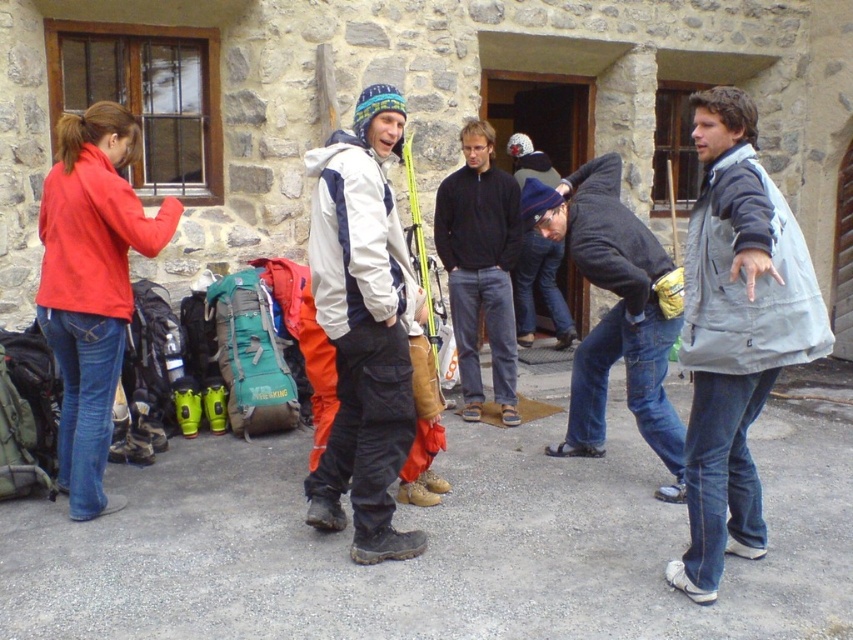
Does dark blue jeans at center have a lesser width compared to black smooth sweater at center?

In fact, dark blue jeans at center might be wider than black smooth sweater at center.

Which is behind, point (608, 262) or point (445, 228)?

The point (445, 228) is behind.

Locate an element on the screen. This screenshot has height=640, width=853. dark blue jeans at center is located at coordinates (613, 310).

You are a GUI agent. You are given a task and a screenshot of the screen. Output one action in this format:
    pyautogui.click(x=<x>, y=<y>)
    Task: Click on the dark blue jeans at center
    The image size is (853, 640).
    Given the screenshot: What is the action you would take?
    pyautogui.click(x=613, y=310)

Can you confirm if white matte jacket at center is positioned above dark blue knit hat at center?

No, white matte jacket at center is not above dark blue knit hat at center.

How far apart are white matte jacket at center and dark blue knit hat at center?

white matte jacket at center and dark blue knit hat at center are 4.35 meters apart from each other.

Does point (389, 195) come in front of point (555, 248)?

Yes, point (389, 195) is in front of point (555, 248).

The width and height of the screenshot is (853, 640). I want to click on white matte jacket at center, so click(x=363, y=326).

In the scene shown: Who is positioned more to the left, black smooth sweater at center or dark blue knit hat at center?

black smooth sweater at center is more to the left.

Which is above, black smooth sweater at center or dark blue knit hat at center?

dark blue knit hat at center

Identify the location of black smooth sweater at center. coord(480,268).

At what (x,y) coordinates should I click in order to perform the action: click on black smooth sweater at center. Please return your answer as a coordinate pair (x, y). This screenshot has width=853, height=640. Looking at the image, I should click on (480, 268).